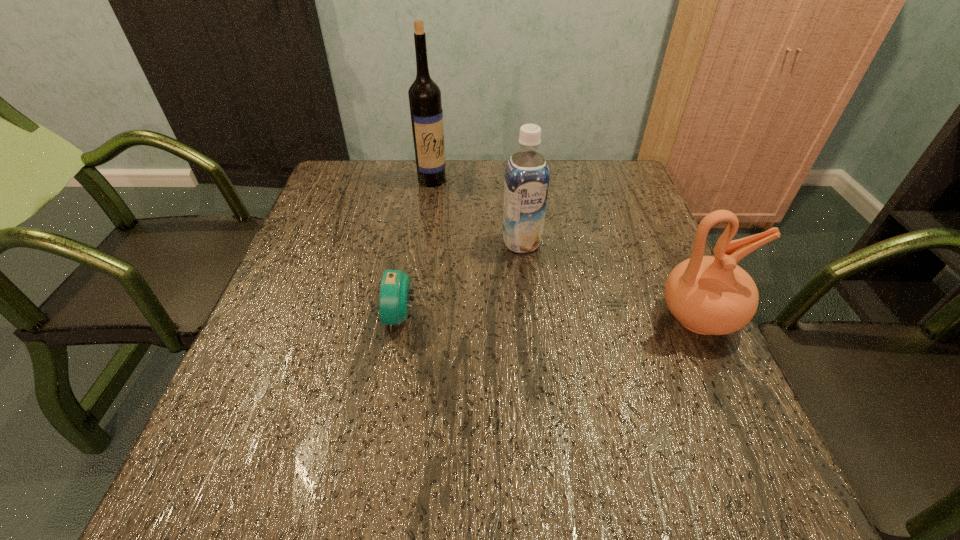
Where is `free spot located 0.280m on the label of the farthest object`? The image size is (960, 540). free spot located 0.280m on the label of the farthest object is located at coordinates (476, 244).

Find the location of a particular element. Image resolution: width=960 pixels, height=540 pixels. vacant space located 0.170m on the label of the farthest object is located at coordinates (459, 219).

At what (x,y) coordinates should I click in order to perform the action: click on vacant space located on the label of the soya milk. Please return your answer as a coordinate pair (x, y). The width and height of the screenshot is (960, 540). Looking at the image, I should click on (537, 287).

Image resolution: width=960 pixels, height=540 pixels. I want to click on vacant space positioned on the label of the soya milk, so click(x=567, y=373).

You are a GUI agent. You are given a task and a screenshot of the screen. Output one action in this format:
    pyautogui.click(x=<x>, y=<y>)
    Task: Click on the vacant space located 0.370m on the label of the soya milk
    Image resolution: width=960 pixels, height=540 pixels.
    Given the screenshot: What is the action you would take?
    pyautogui.click(x=572, y=387)

Find the location of `object situated at the far edge`. object situated at the far edge is located at coordinates (424, 94).

This screenshot has height=540, width=960. In order to click on object at the right edge in this screenshot , I will do `click(708, 295)`.

Find the location of a particular element. The height and width of the screenshot is (540, 960). free space at the far edge is located at coordinates (481, 191).

Locate an element on the screen. vacant space at the left edge of the desktop is located at coordinates (285, 372).

The height and width of the screenshot is (540, 960). In the image, there is a desktop. What are the coordinates of `vacant space at the right edge` in the screenshot? It's located at (590, 218).